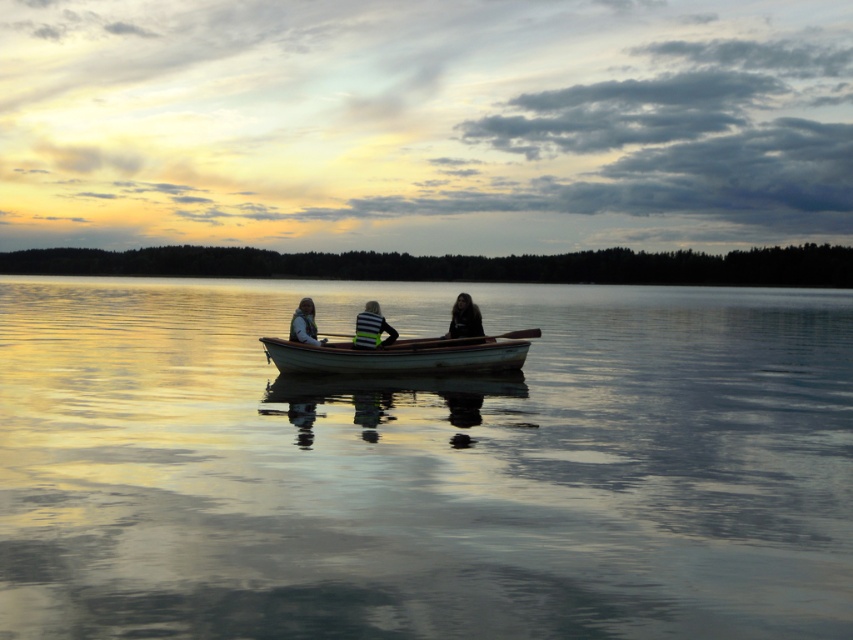
You are standing on the shore of the lake and see the point marked at coordinates (372,328). What object is located at that point?

The point at coordinates (372,328) marks the location of the matte white boat at center.

You are a safety inspector checking the placement of the life vest in the matte white boat at center. According to maritime safety regulations, the life vest must be within 30 inches of the boat operator. Is the matte black life vest at center positioned correctly?

The distance between the matte white boat at center and the matte black life vest at center is 34.61 inches. Since this exceeds the 30 inch requirement, the life vest is not positioned correctly according to regulations.

You are a safety inspector checking the placement of the life vest on the boat. According to the image, is the matte black life vest at center positioned in front of or behind the matte white boat at center?

The matte white boat at center is in front of the matte black life vest at center, so the life vest is positioned behind the boat.